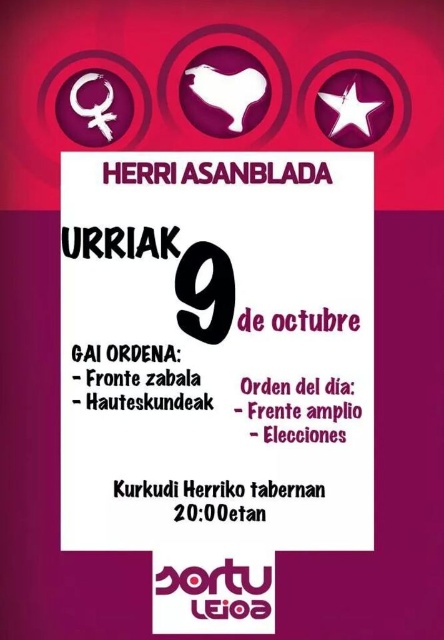
Does white paper sign at center lie behind black paper number at center?

No, it is not.

Who is more distant from viewer, (364, 305) or (178, 275)?

The point (178, 275) is behind.

Identify the location of white paper sign at center. (217, 346).